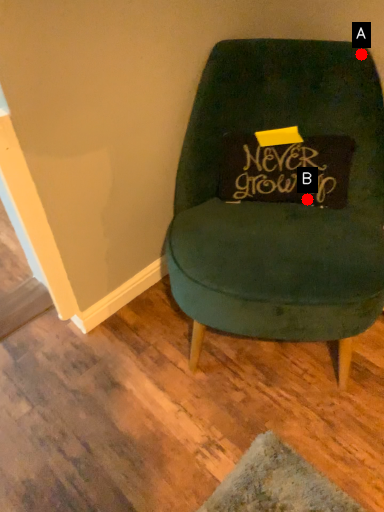
Question: Two points are circled on the image, labeled by A and B beside each circle. Which point appears farthest from the camera in this image?

Choices:
 (A) A is further
 (B) B is further

Answer: (B)